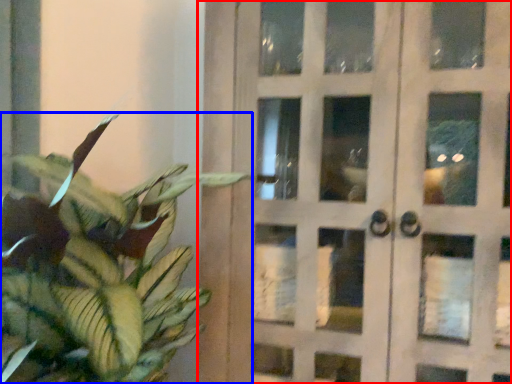
Question: Among these objects, which one is farthest to the camera, door (highlighted by a red box) or houseplant (highlighted by a blue box)?

Choices:
 (A) door
 (B) houseplant

Answer: (A)